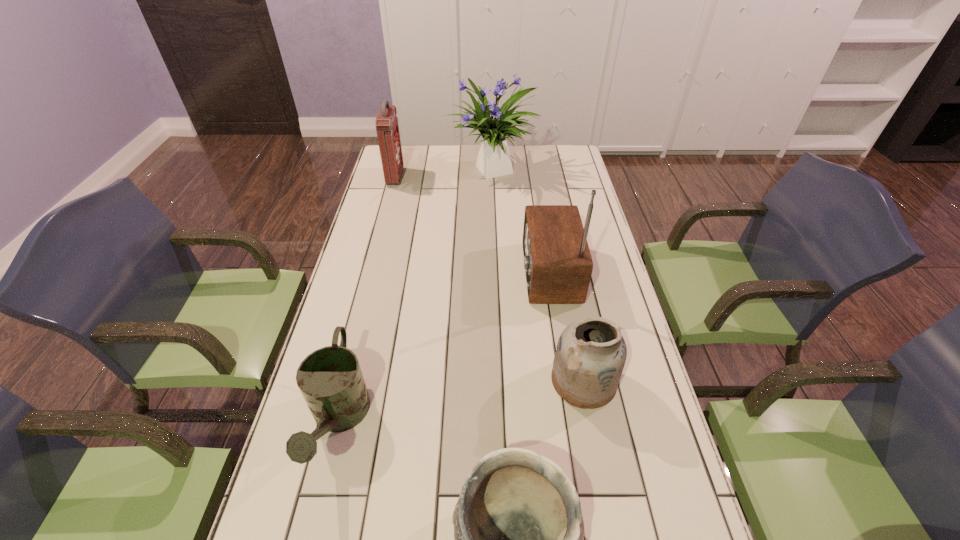
Find the location of `flower arrangement`. flower arrangement is located at coordinates (493, 160).

Identify the location of the fourth nearest object. (558, 265).

Identify the location of the first-aid kit. This screenshot has width=960, height=540. (387, 128).

Identify the location of the farther pottery. This screenshot has width=960, height=540. (591, 353).

Find the location of a particular element. The width and height of the screenshot is (960, 540). watering can is located at coordinates (330, 379).

Where is `blank area located on the right of the flower arrangement`? This screenshot has height=540, width=960. blank area located on the right of the flower arrangement is located at coordinates (573, 172).

At what (x,y) coordinates should I click in order to perform the action: click on free space located on the front-facing side of the third farthest object. Please return your answer as a coordinate pair (x, y). Looking at the image, I should click on (423, 272).

Identify the location of vacant space situated on the front-facing side of the third farthest object. The image size is (960, 540). (398, 272).

I want to click on vacant point located 0.150m on the front-facing side of the third farthest object, so click(x=474, y=272).

You are a GUI agent. You are given a task and a screenshot of the screen. Output one action in this format:
    pyautogui.click(x=<x>, y=<y>)
    Task: Click on the vacant space located 0.060m on the front-facing side of the first-aid kit
    
    Given the screenshot: What is the action you would take?
    pyautogui.click(x=416, y=177)